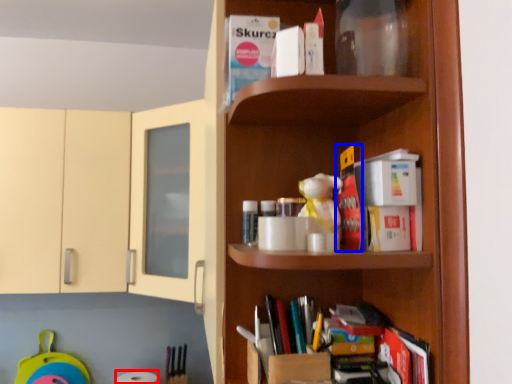
Question: Which point is closer to the camera, toilet paper (highlighted by a red box) or book (highlighted by a blue box)?

Choices:
 (A) toilet paper
 (B) book

Answer: (B)